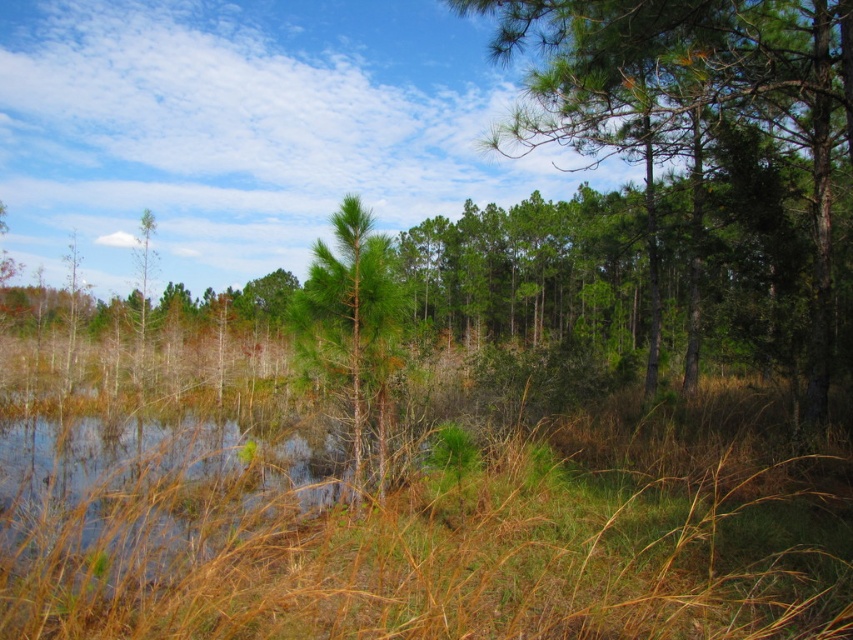
Question: Which object appears farthest from the camera in this image?

Choices:
 (A) green leafy tree at center
 (B) green matte tree at center

Answer: (A)

Question: Considering the relative positions of green leafy tree at center and green matte tree at center in the image provided, where is green leafy tree at center located with respect to green matte tree at center?

Choices:
 (A) right
 (B) left

Answer: (A)

Question: Which object appears closest to the camera in this image?

Choices:
 (A) green leafy tree at center
 (B) green matte tree at center

Answer: (B)

Question: Is green leafy tree at center below green matte tree at center?

Choices:
 (A) yes
 (B) no

Answer: (B)

Question: Is green leafy tree at center further to the viewer compared to green matte tree at center?

Choices:
 (A) yes
 (B) no

Answer: (A)

Question: Which object is closer to the camera taking this photo?

Choices:
 (A) green leafy tree at center
 (B) green matte tree at center

Answer: (B)